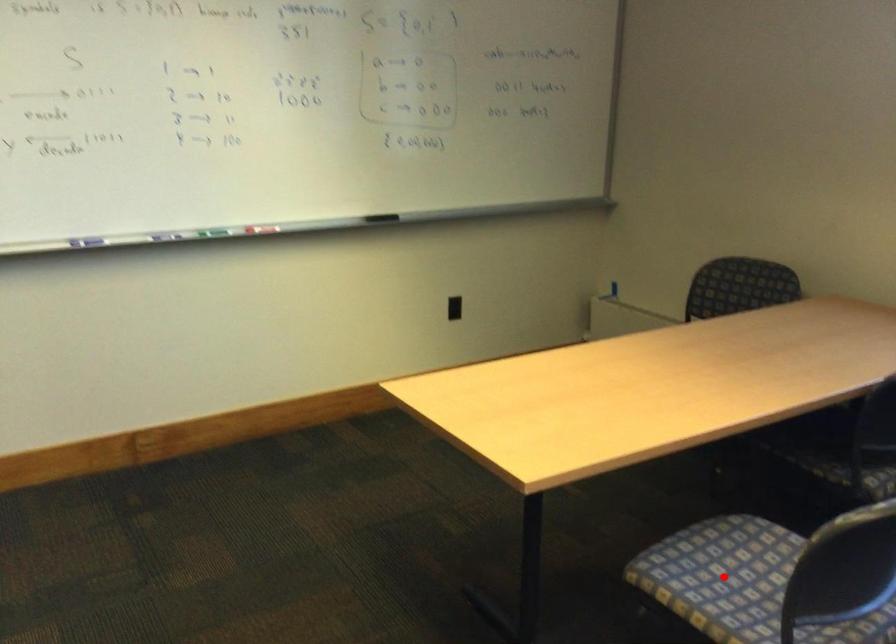
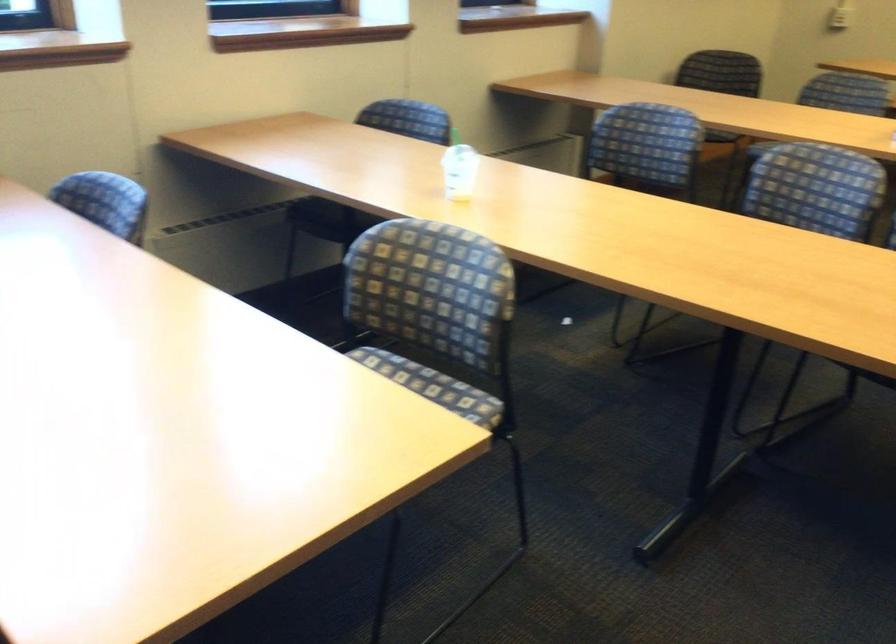
Question: I am providing you with two images of the same scene from different viewpoints. A red point is marked on the first image. Can you still see the location of the red point in image 2?

Choices:
 (A) Yes
 (B) No

Answer: (B)